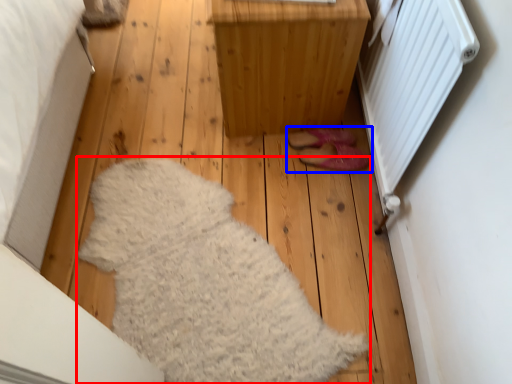
Question: Which of the following is the closest to the observer, blanket (highlighted by a red box) or footwear (highlighted by a blue box)?

Choices:
 (A) blanket
 (B) footwear

Answer: (A)